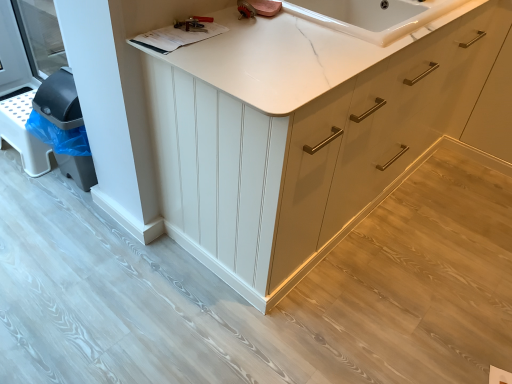
Question: Should I look upward or downward to see matte white cabinet at center?

Choices:
 (A) down
 (B) up

Answer: (B)

Question: From the image's perspective, is matte white cabinet at center below metallic silver wrench at upper center?

Choices:
 (A) yes
 (B) no

Answer: (A)

Question: Is matte white cabinet at center at the right side of metallic silver wrench at upper center?

Choices:
 (A) no
 (B) yes

Answer: (B)

Question: Does matte white cabinet at center come in front of metallic silver wrench at upper center?

Choices:
 (A) no
 (B) yes

Answer: (B)

Question: Can you confirm if matte white cabinet at center is taller than metallic silver wrench at upper center?

Choices:
 (A) no
 (B) yes

Answer: (B)

Question: From a real-world perspective, is matte white cabinet at center on metallic silver wrench at upper center?

Choices:
 (A) yes
 (B) no

Answer: (B)

Question: Is metallic silver wrench at upper center surrounded by matte white cabinet at center?

Choices:
 (A) no
 (B) yes

Answer: (B)

Question: Does metallic silver wrench at upper center come behind matte white cabinet at center?

Choices:
 (A) yes
 (B) no

Answer: (A)

Question: Is there a large distance between metallic silver wrench at upper center and matte white cabinet at center?

Choices:
 (A) no
 (B) yes

Answer: (A)

Question: Could matte white cabinet at center be considered to be inside metallic silver wrench at upper center?

Choices:
 (A) yes
 (B) no

Answer: (B)

Question: Does metallic silver wrench at upper center have a larger size compared to matte white cabinet at center?

Choices:
 (A) yes
 (B) no

Answer: (B)

Question: Considering the relative sizes of metallic silver wrench at upper center and matte white cabinet at center in the image provided, is metallic silver wrench at upper center wider than matte white cabinet at center?

Choices:
 (A) yes
 (B) no

Answer: (B)

Question: Is metallic silver wrench at upper center turned away from matte white cabinet at center?

Choices:
 (A) no
 (B) yes

Answer: (B)

Question: From the image's perspective, does white marble countertop at upper center appear lower than metallic silver wrench at upper center?

Choices:
 (A) yes
 (B) no

Answer: (B)